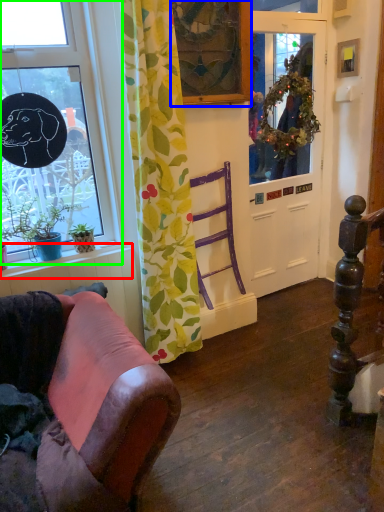
Question: Considering the real-world distances, which object is farthest from window sill (highlighted by a red box)? picture frame (highlighted by a blue box) or window (highlighted by a green box)?

Choices:
 (A) picture frame
 (B) window

Answer: (A)